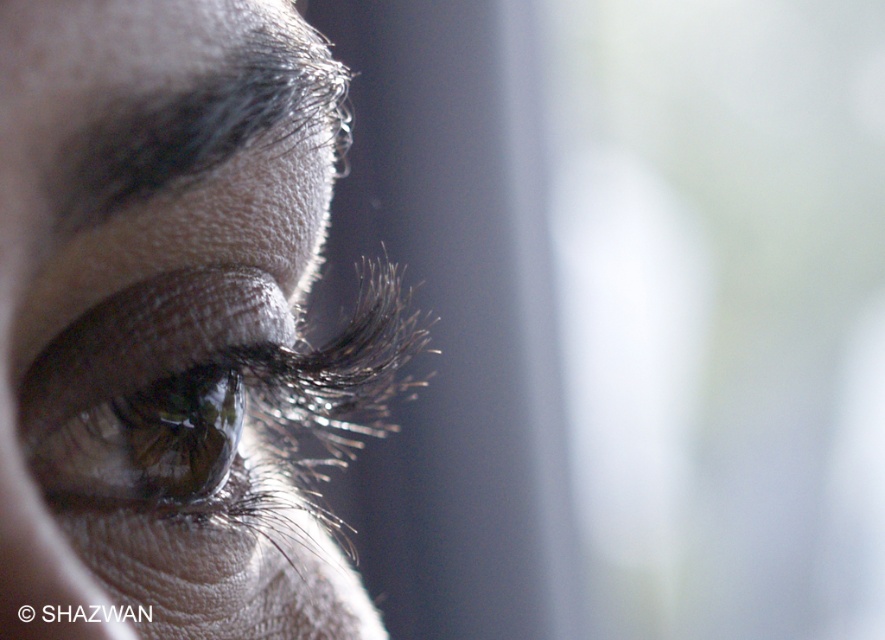
Does matte skin eye at center appear on the left side of brown glossy eye at center?

In fact, matte skin eye at center is to the right of brown glossy eye at center.

Who is more forward, (239, 99) or (199, 460)?

Positioned in front is point (239, 99).

The image size is (885, 640). What do you see at coordinates (175, 324) in the screenshot?
I see `matte skin eye at center` at bounding box center [175, 324].

At what (x,y) coordinates should I click in order to perform the action: click on matte skin eye at center. Please return your answer as a coordinate pair (x, y). Looking at the image, I should click on (175, 324).

Which is below, dark matte eyebrow at upper left or brown glossy eye at center?

brown glossy eye at center is lower down.

The image size is (885, 640). What do you see at coordinates (204, 118) in the screenshot? I see `dark matte eyebrow at upper left` at bounding box center [204, 118].

Does point (132, 120) lie behind point (71, 467)?

That is False.

You are a GUI agent. You are given a task and a screenshot of the screen. Output one action in this format:
    pyautogui.click(x=<x>, y=<y>)
    Task: Click on the dark matte eyebrow at upper left
    The width and height of the screenshot is (885, 640).
    Given the screenshot: What is the action you would take?
    pyautogui.click(x=204, y=118)

Does matte skin eye at center have a lesser width compared to dark matte eyebrow at upper left?

In fact, matte skin eye at center might be wider than dark matte eyebrow at upper left.

Can you confirm if matte skin eye at center is positioned to the left of dark matte eyebrow at upper left?

Correct, you'll find matte skin eye at center to the left of dark matte eyebrow at upper left.

Which is behind, point (213, 259) or point (299, 125)?

The point (299, 125) is more distant.

You are a GUI agent. You are given a task and a screenshot of the screen. Output one action in this format:
    pyautogui.click(x=<x>, y=<y>)
    Task: Click on the matte skin eye at center
    This screenshot has height=640, width=885.
    Given the screenshot: What is the action you would take?
    pyautogui.click(x=175, y=324)